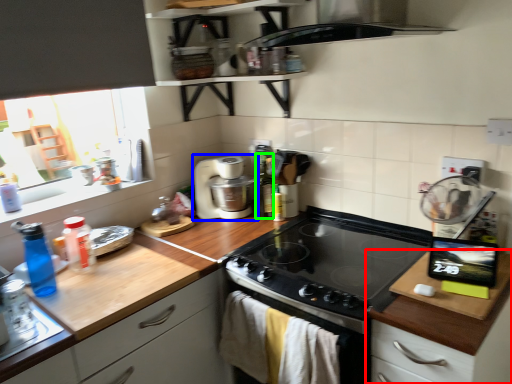
Question: Estimate the real-world distances between objects in this image. Which object is closer to cabinetry (highlighted by a red box), home appliance (highlighted by a blue box) or bottle (highlighted by a green box)?

Choices:
 (A) home appliance
 (B) bottle

Answer: (B)